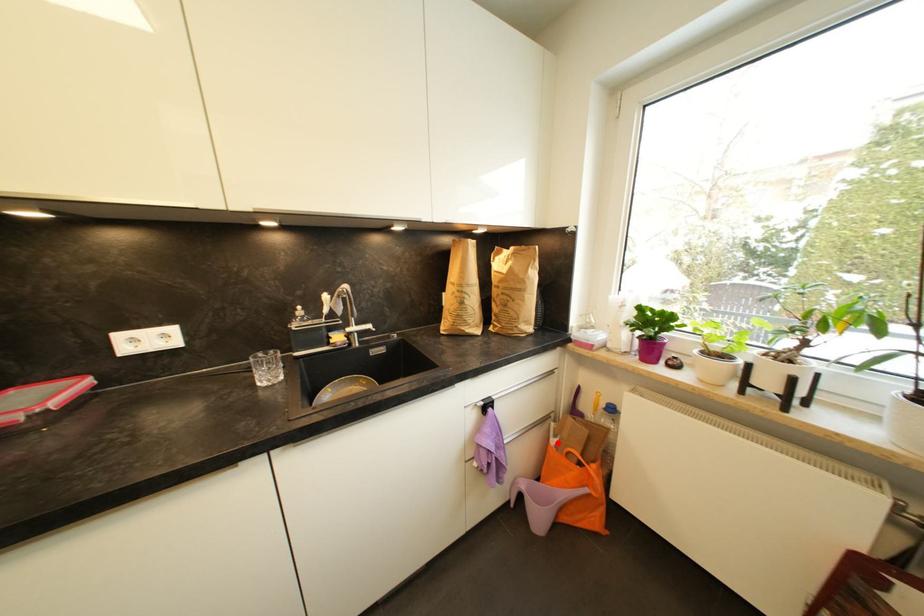
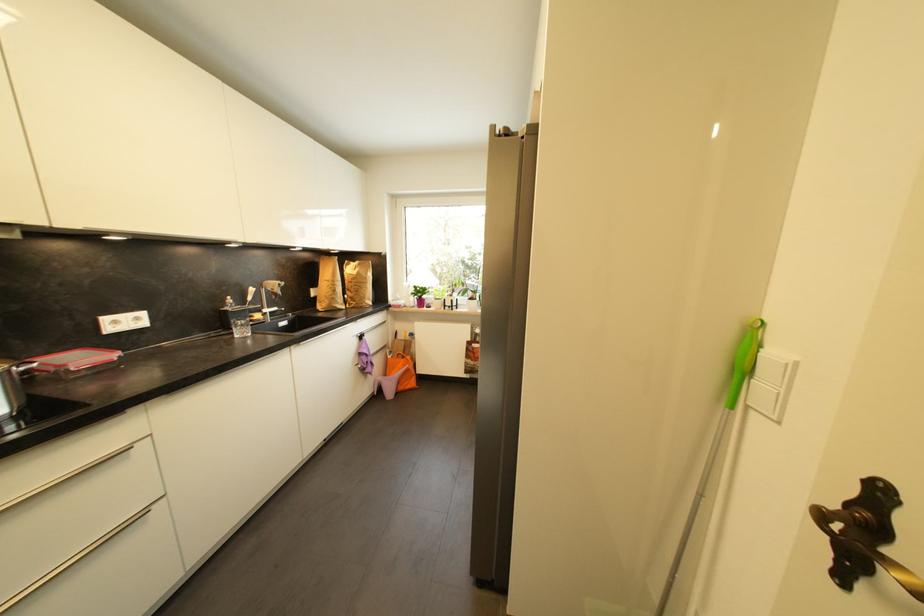
Find the pixel in the second image that matches the highlighted location in the first image.

(395, 359)